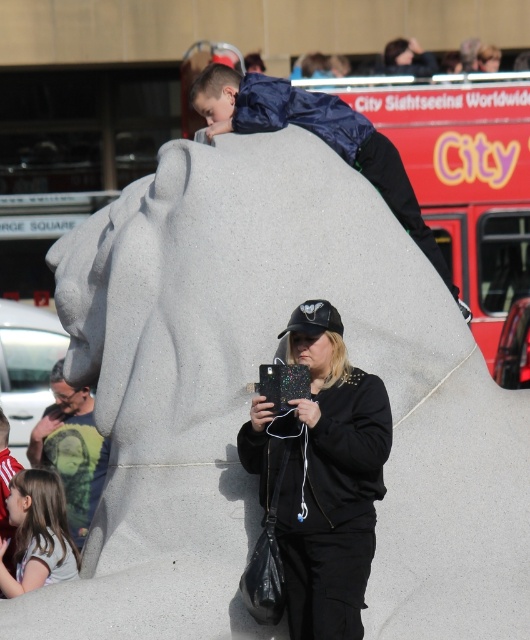
Does point (281, 106) lie in front of point (76, 422)?

Yes, it is.

Which is more to the right, matte blue jacket at upper center or green t-shirt at left?

From the viewer's perspective, matte blue jacket at upper center appears more on the right side.

In order to click on matte blue jacket at upper center in this screenshot , I will do `click(320, 138)`.

Between matte blue jacket at upper center and light brown hair at lower left, which one is positioned lower?

light brown hair at lower left is below.

Is point (312, 102) closer to viewer compared to point (0, 445)?

Yes, it is in front of point (0, 445).

Image resolution: width=530 pixels, height=640 pixels. What are the coordinates of `matte blue jacket at upper center` in the screenshot? It's located at (320, 138).

Is black matte jacket at center positioned before light brown hair at lower left?

Yes, black matte jacket at center is closer to the viewer.

Is black matte jacket at center positioned behind light brown hair at lower left?

No, it is in front of light brown hair at lower left.

Between point (355, 435) and point (0, 483), which one is positioned behind?

The point (0, 483) is behind.

Image resolution: width=530 pixels, height=640 pixels. Identify the location of black matte jacket at center. (323, 477).